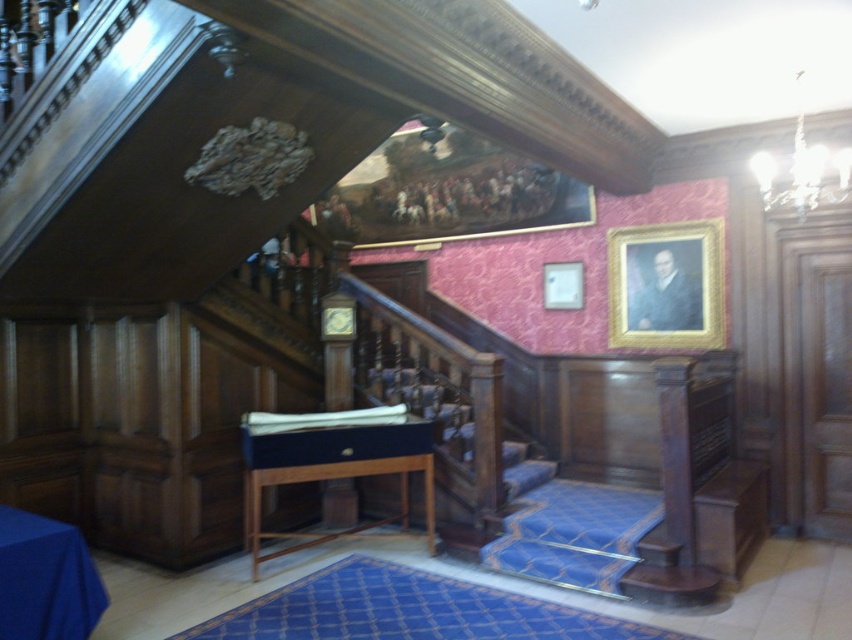
This screenshot has height=640, width=852. I want to click on oil painting at upper center, so click(x=447, y=193).

Is oil painting at upper center positioned before gold-framed picture at upper center?

Yes, it is.

Locate an element on the screen. oil painting at upper center is located at coordinates [x=447, y=193].

Is oil painting at upper center bigger than blue fabric tablecloth at lower left?

Indeed, oil painting at upper center has a larger size compared to blue fabric tablecloth at lower left.

Which of these two, oil painting at upper center or blue fabric tablecloth at lower left, stands taller?

With more height is oil painting at upper center.

Consider the image. Who is more forward, (x=537, y=205) or (x=78, y=554)?

Positioned in front is point (x=78, y=554).

Find the location of a particular element. oil painting at upper center is located at coordinates (447, 193).

Describe the element at coordinates (666, 285) in the screenshot. The image size is (852, 640). I see `gold/gilded wood portrait at upper right` at that location.

Can you confirm if gold/gilded wood portrait at upper right is taller than blue fabric tablecloth at lower left?

Indeed, gold/gilded wood portrait at upper right has a greater height compared to blue fabric tablecloth at lower left.

Which is behind, point (709, 284) or point (66, 540)?

The point (709, 284) is more distant.

Where is `gold/gilded wood portrait at upper right`? The height and width of the screenshot is (640, 852). gold/gilded wood portrait at upper right is located at coordinates (666, 285).